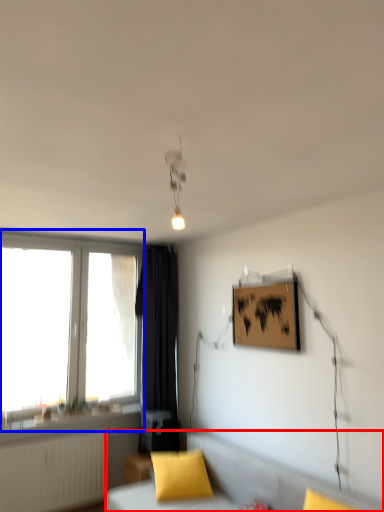
Question: Which point is closer to the camera, furniture (highlighted by a red box) or window (highlighted by a blue box)?

Choices:
 (A) furniture
 (B) window

Answer: (A)